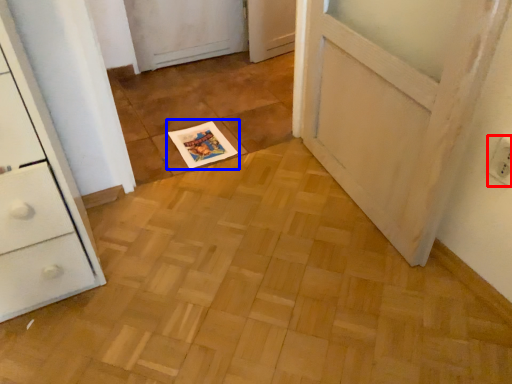
Question: Which of the following is the farthest to the observer, electric outlet (highlighted by a red box) or magazine (highlighted by a blue box)?

Choices:
 (A) electric outlet
 (B) magazine

Answer: (B)